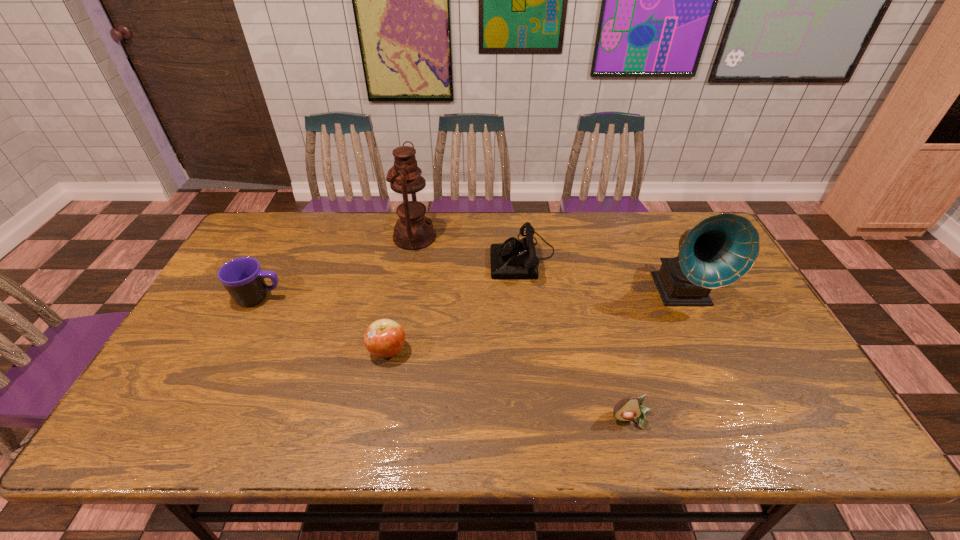
Find the location of a particular element. Image resolution: width=960 pixels, height=540 pixels. oil lamp is located at coordinates (413, 231).

This screenshot has height=540, width=960. Identify the location of phonograph_record. (719, 250).

At what (x,y) coordinates should I click in order to perform the action: click on telephone. Please return your answer as a coordinate pair (x, y). This screenshot has height=540, width=960. Looking at the image, I should click on (514, 259).

You are a GUI agent. You are given a task and a screenshot of the screen. Output one action in this format:
    pyautogui.click(x=<x>, y=<y>)
    Task: Click on the leftmost object
    Image resolution: width=960 pixels, height=540 pixels.
    Given the screenshot: What is the action you would take?
    pyautogui.click(x=242, y=277)

Where is `the second object from right to left`? the second object from right to left is located at coordinates (628, 409).

This screenshot has height=540, width=960. Identify the location of avocado. (628, 409).

Locate an element on the screen. the fifth farthest object is located at coordinates (384, 338).

I want to click on vacant space situated on the front of the oil lamp, so click(x=409, y=271).

This screenshot has height=540, width=960. What are the coordinates of `free space located from the horn of the phonograph_record` in the screenshot? It's located at (712, 356).

Find the location of a particular element. The image size is (960, 540). vacant space located on the front face of the third object from right to left is located at coordinates (367, 256).